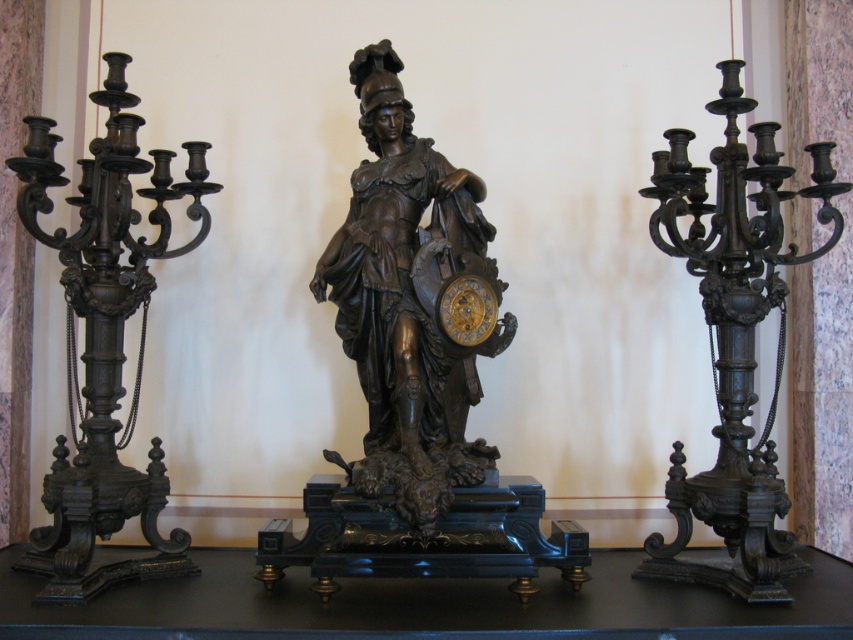
Question: Which point appears farthest from the camera in this image?

Choices:
 (A) (447, 317)
 (B) (734, 499)
 (C) (48, 481)
 (D) (505, 342)

Answer: (C)

Question: Is black polished wood table at center closer to camera compared to gold polished metal clock at center?

Choices:
 (A) yes
 (B) no

Answer: (A)

Question: Which object appears closest to the camera in this image?

Choices:
 (A) gold polished metal clock at center
 (B) polished bronze candelabra at left
 (C) black polished wood table at center

Answer: (C)

Question: Which point is closer to the camera?

Choices:
 (A) (138, 592)
 (B) (674, 481)
 (C) (448, 310)

Answer: (A)

Question: Is black polished wood table at center to the right of polished bronze candelabra at left from the viewer's perspective?

Choices:
 (A) no
 (B) yes

Answer: (B)

Question: Does bronze statue at center have a smaller size compared to gold polished metal clock at center?

Choices:
 (A) yes
 (B) no

Answer: (B)